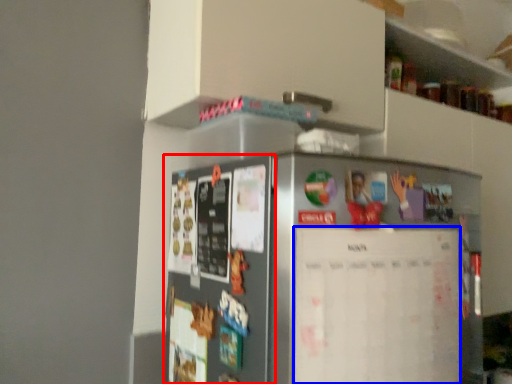
Question: Which point is closer to the camera, fridge (highlighted by a red box) or bulletin board (highlighted by a blue box)?

Choices:
 (A) fridge
 (B) bulletin board

Answer: (A)